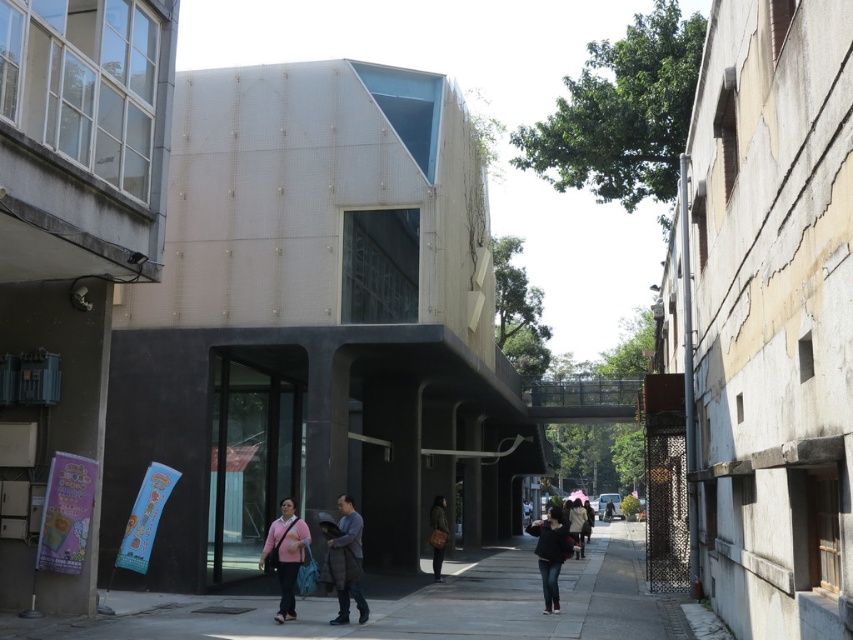
Describe the element at coordinates (351, 561) in the screenshot. The image size is (853, 640). I see `dark gray fabric coat at center` at that location.

Does dark gray fabric coat at center have a greater height compared to pink fabric umbrella at center?

No, dark gray fabric coat at center is not taller than pink fabric umbrella at center.

Is point (347, 595) farther from camera compared to point (582, 547)?

No.

Locate an element on the screen. Image resolution: width=853 pixels, height=640 pixels. dark gray fabric coat at center is located at coordinates (351, 561).

Between point (337, 499) and point (434, 499), which one is positioned in front?

Point (337, 499) is in front.

Can you confirm if dark gray fabric coat at center is bigger than brown leather bag at center?

Correct, dark gray fabric coat at center is larger in size than brown leather bag at center.

Identify the location of dark gray fabric coat at center. The height and width of the screenshot is (640, 853). (351, 561).

Where is `dark gray fabric coat at center`? Image resolution: width=853 pixels, height=640 pixels. dark gray fabric coat at center is located at coordinates (351, 561).

The image size is (853, 640). Describe the element at coordinates (418, 605) in the screenshot. I see `concrete at center` at that location.

Does concrete at center appear on the right side of brown leather bag at center?

Correct, you'll find concrete at center to the right of brown leather bag at center.

Is point (526, 560) less distant than point (438, 548)?

No, it is behind (438, 548).

Locate an element on the screen. This screenshot has height=640, width=853. concrete at center is located at coordinates (418, 605).